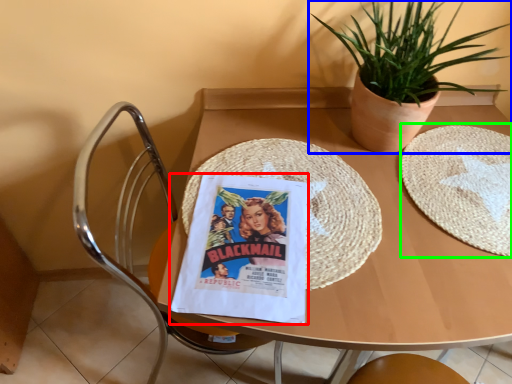
Question: Estimate the real-world distances between objects in this image. Which object is closer to comic book (highlighted by a red box), houseplant (highlighted by a blue box) or paper plate (highlighted by a green box)?

Choices:
 (A) houseplant
 (B) paper plate

Answer: (B)